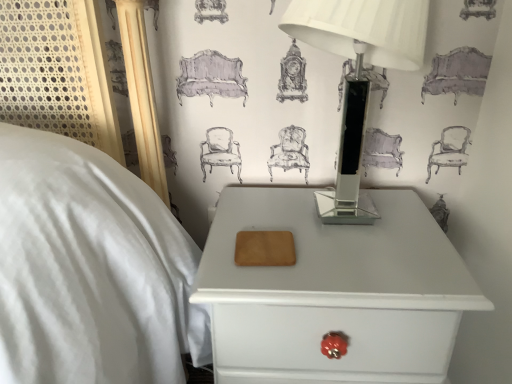
What are the coordinates of `vacant space underneath clear glass table lamp at upper right (from a real-world perspective)` in the screenshot? It's located at pyautogui.click(x=333, y=220).